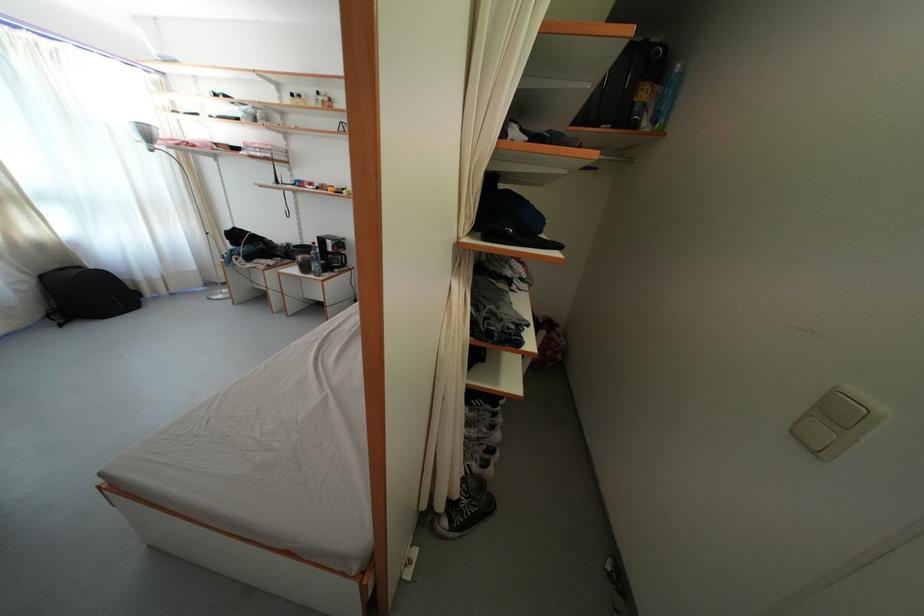
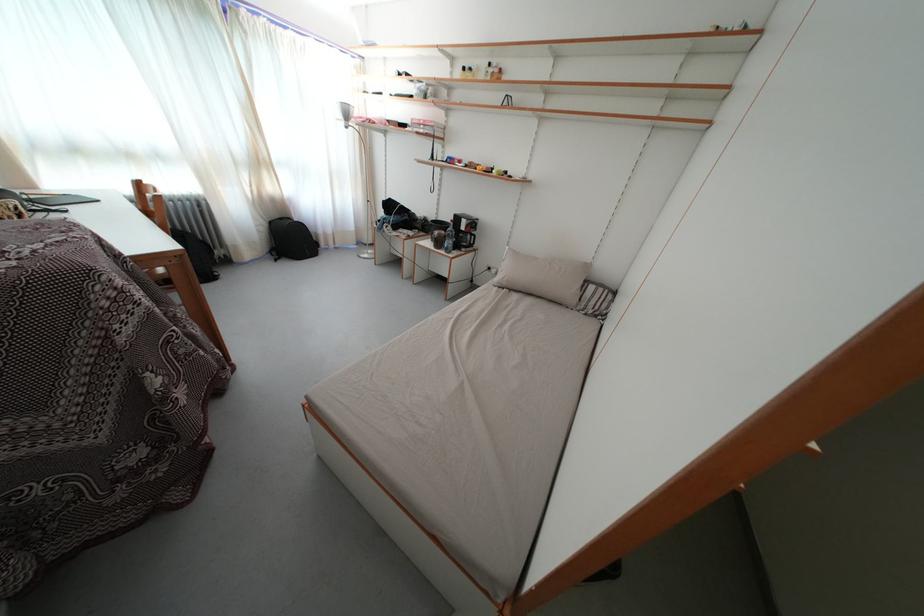
Where in the second image is the point corresponding to (37,285) from the first image?

(272, 230)